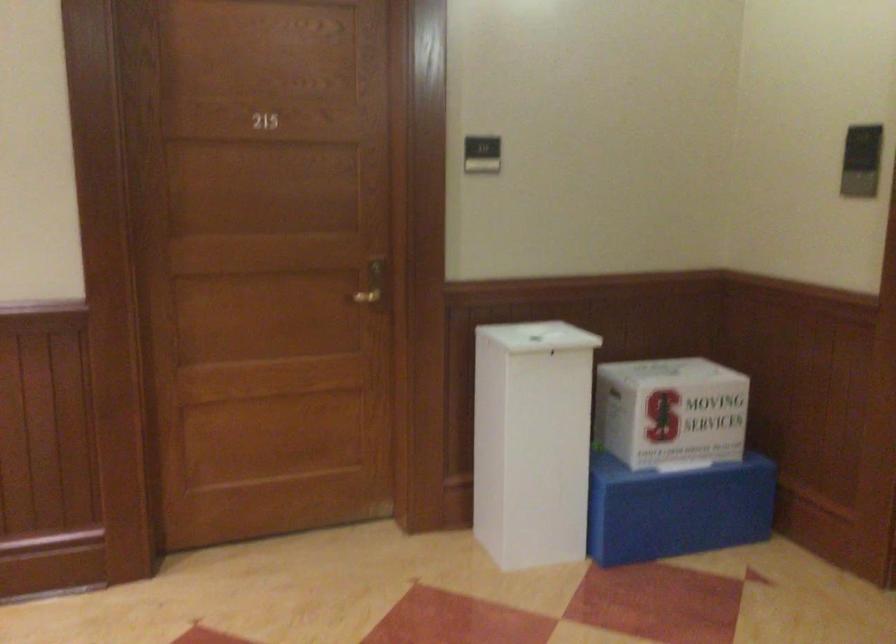
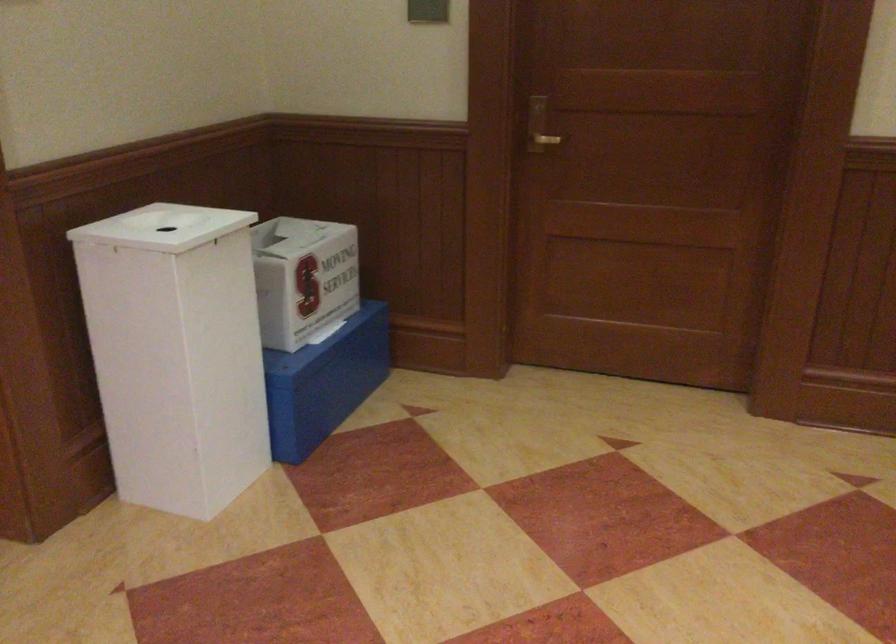
The point at (497, 429) is marked in the first image. Where is the corresponding point in the second image?

(176, 353)